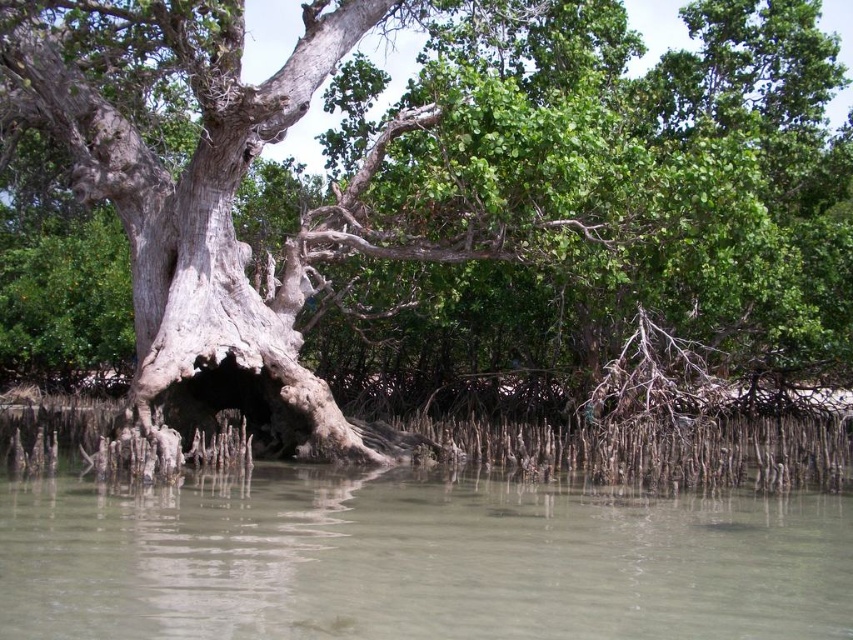
Who is positioned more to the right, grayish-brown bark tree at center or clear sediment river at lower center?

Positioned to the right is grayish-brown bark tree at center.

Consider the image. Who is positioned more to the left, grayish-brown bark tree at center or clear sediment river at lower center?

Positioned to the left is clear sediment river at lower center.

Is point (494, 83) more distant than point (584, 499)?

Yes, point (494, 83) is farther from viewer.

I want to click on grayish-brown bark tree at center, so click(439, 180).